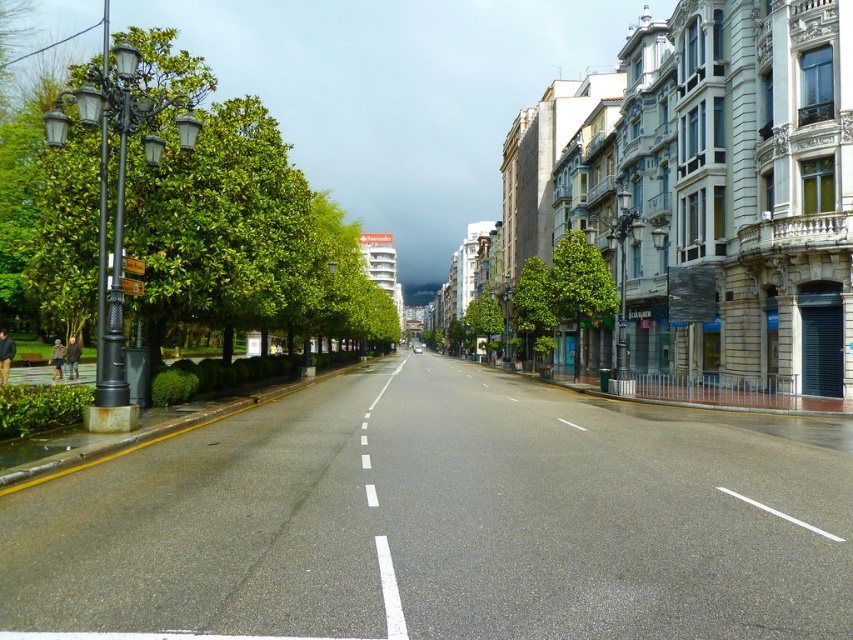
You are standing at the center of the street and want to reach the green leafy tree at left. In which direction should you walk?

The green leafy tree at left is located at point (242, 234), so you should walk towards the left side of the street to reach it.

You are standing at the point marked as point (184, 65) on the map of the urban street. You want to take a photo of the entire street from your current position. Considering the distance between you and the camera, will the camera be able to capture the entire street in one shot?

The distance between point (184, 65) and the camera is 20.17 meters. However, without knowing the camera lens focal length or sensor size, it is impossible to determine if the entire street can be captured in one shot.